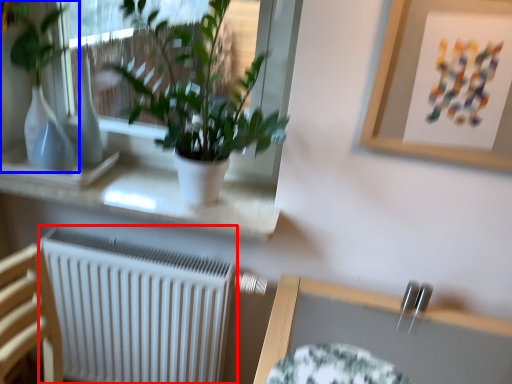
Question: Which of the following is the farthest to the observer, radiator (highlighted by a red box) or houseplant (highlighted by a blue box)?

Choices:
 (A) radiator
 (B) houseplant

Answer: (A)